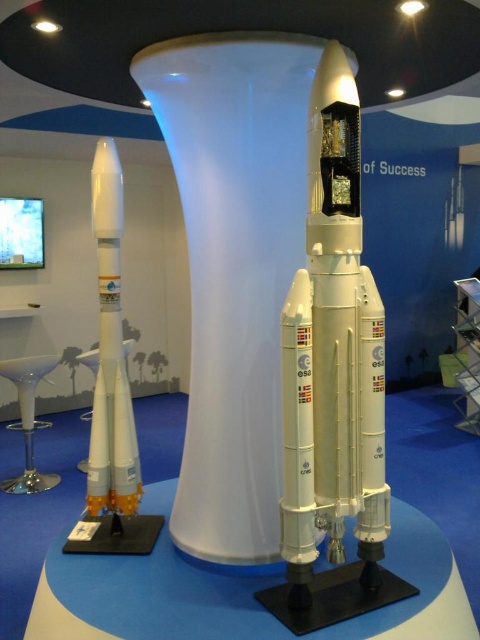
Question: Is white matte rocket at center to the left of white matte rocket at left from the viewer's perspective?

Choices:
 (A) yes
 (B) no

Answer: (B)

Question: Among these points, which one is farthest from the camera?

Choices:
 (A) (327, 166)
 (B) (108, 264)

Answer: (B)

Question: Is white matte rocket at center further to camera compared to white matte rocket at left?

Choices:
 (A) no
 (B) yes

Answer: (A)

Question: Among these points, which one is farthest from the camera?

Choices:
 (A) [307, 516]
 (B) [108, 237]

Answer: (B)

Question: Can you confirm if white matte rocket at center is smaller than white matte rocket at left?

Choices:
 (A) yes
 (B) no

Answer: (B)

Question: Which point is farther to the camera?

Choices:
 (A) white matte rocket at center
 (B) white matte rocket at left

Answer: (B)